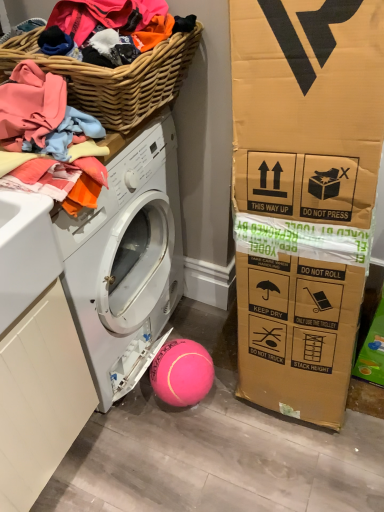
The width and height of the screenshot is (384, 512). I want to click on free space above pink rubber ball at lower center (from a real-world perspective), so click(x=180, y=358).